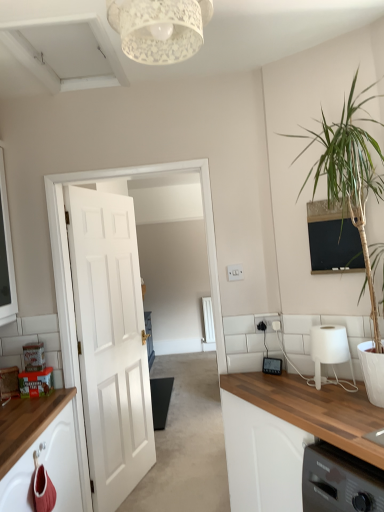
Identify the location of vacant space situated above white glossy door at center (from a real-world perspective). The image size is (384, 512). (126, 166).